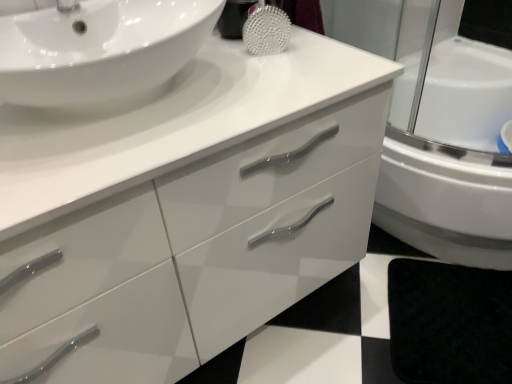
Question: Is black matte bath mat at lower right bigger or smaller than glossy white cabinet at center?

Choices:
 (A) big
 (B) small

Answer: (B)

Question: From the image's perspective, relative to glossy white cabinet at center, is black matte bath mat at lower right above or below?

Choices:
 (A) below
 (B) above

Answer: (A)

Question: Which object is the closest to the white glossy sink at upper left?

Choices:
 (A) black matte bath mat at lower right
 (B) glossy white cabinet at center

Answer: (B)

Question: Which of these objects is positioned farthest from the black matte bath mat at lower right?

Choices:
 (A) white glossy sink at upper left
 (B) glossy white cabinet at center

Answer: (A)